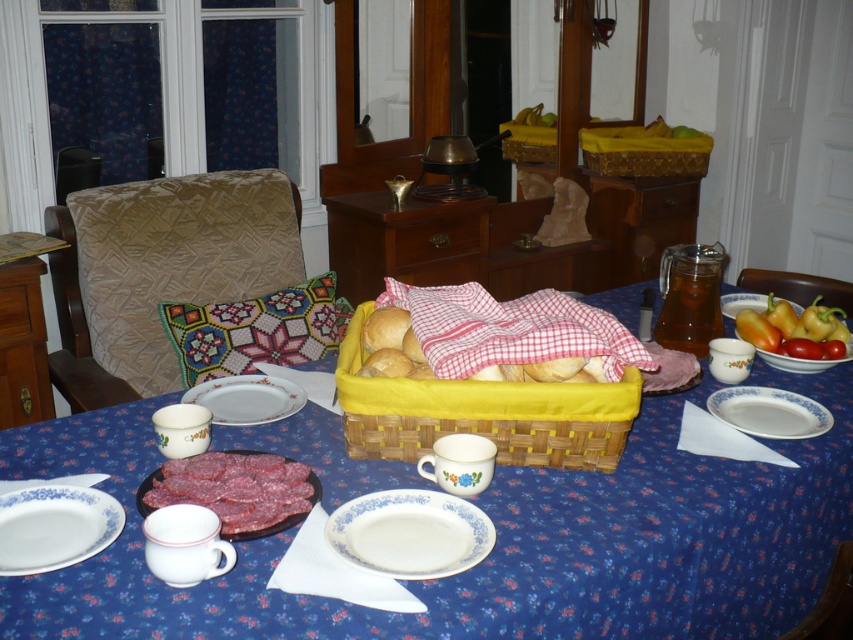
Question: Does red checkered cloth at center have a smaller size compared to smooth yellow peppers at right?

Choices:
 (A) yes
 (B) no

Answer: (B)

Question: Which of the following is the farthest from the observer?

Choices:
 (A) white ceramic platter at lower left
 (B) blue floral tablecloth at center
 (C) yellow matte plate at right

Answer: (C)

Question: Which of the following is the closest to the observer?

Choices:
 (A) smooth yellow peppers at right
 (B) red checkered cloth at center

Answer: (B)

Question: Does white ceramic plate at lower left appear on the left side of white ceramic plate at lower right?

Choices:
 (A) yes
 (B) no

Answer: (A)

Question: Which of the following is the closest to the observer?

Choices:
 (A) white porcelain plate at center
 (B) white ceramic plate at lower right

Answer: (A)

Question: Does white porcelain plate at center appear under white ceramic plate at lower right?

Choices:
 (A) no
 (B) yes

Answer: (B)